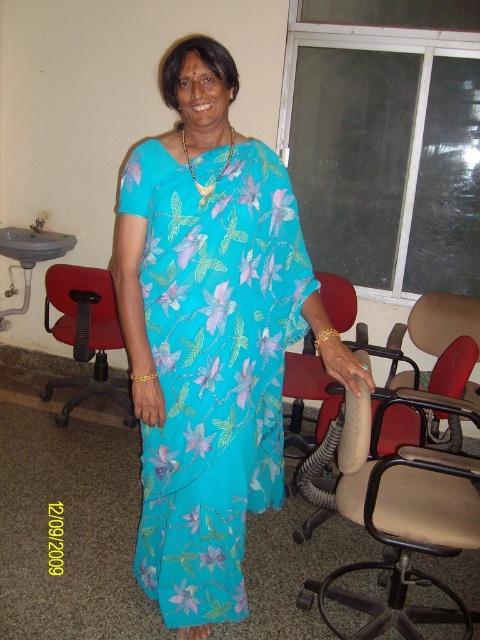
You are an interior designer assessing the layout of an office. You notice the turquoise floral fabric dress at center and the matte red chair at left. Based on their positions, which object is closer to the floor?

The turquoise floral fabric dress at center is closer to the floor because it is positioned below the matte red chair at left.

You are organizing a photo shoot in an office space. You have a turquoise floral fabric dress at center and a matte red chair at left. Which object takes up more physical space in the scene?

The matte red chair at left takes up more physical space in the scene than the turquoise floral fabric dress at center because the dress occupies less space than the chair.

You are a photographer setting up for a photoshoot in an office. You need to ensure that the turquoise floral fabric dress at center is visible above the matte red chair at left in the frame. Based on their heights, will the dress be visible above the chair?

The turquoise floral fabric dress at center is taller than the matte red chair at left, so yes, the dress will be visible above the chair in the frame.